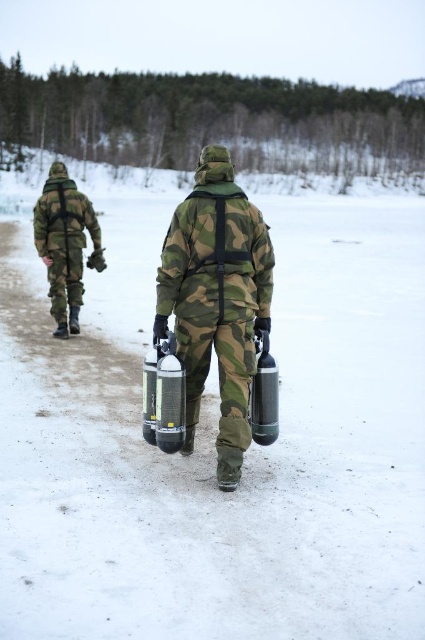
You are a photographer trying to capture a clear shot of the metallic silver cylinder at center while ensuring the camo fabric uniform at center is also visible in the frame. Given their sizes, which object should you focus on first to ensure both are in focus?

The camo fabric uniform at center is taller than the metallic silver cylinder at center, so focusing on the camo fabric uniform at center first will help ensure both are in focus as it is larger in the frame.

You are a photographer trying to capture the metallic silver cylinder at center in your shot. The camouflage fabric uniform at left is blocking your view. Can you move the uniform to the right to get a clear shot of the cylinder?

The camouflage fabric uniform at left is above the metallic silver cylinder at center, so moving the uniform to the right would not necessarily unblock the view since the cylinder is below the uniform in the vertical axis.

You are a photographer trying to capture a clear photo of the metallic silver cylinder at center. Since the camo fabric uniform at center is blocking your view, can you move the camera up or down to see it better?

The camo fabric uniform at center is above the metallic silver cylinder at center, so moving the camera down would allow you to see the metallic silver cylinder at center without obstruction.